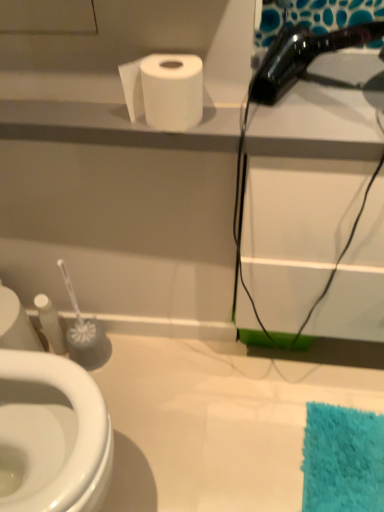
In order to click on vacant area that is situated to the right of white matte toilet paper at upper center in this screenshot , I will do `click(273, 115)`.